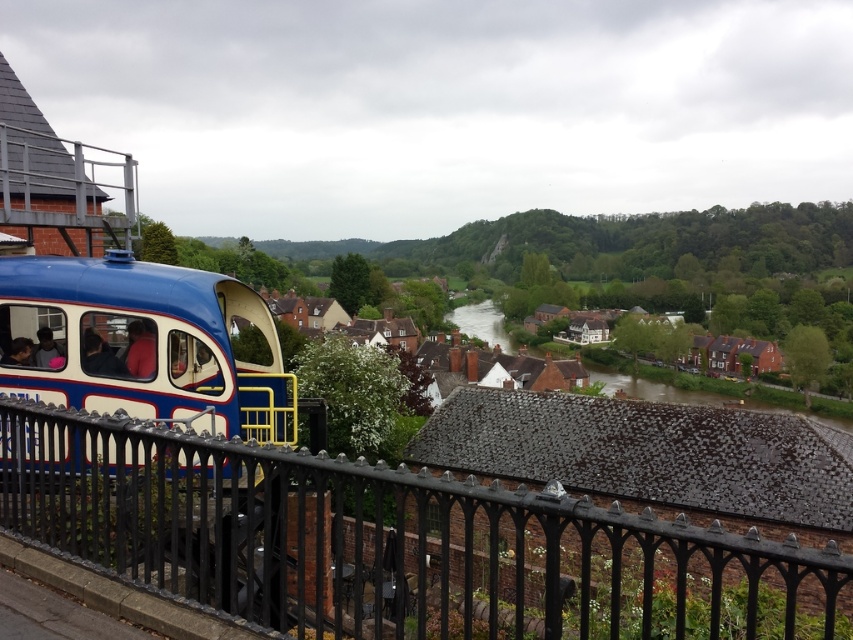
Locate an element on the screen. The width and height of the screenshot is (853, 640). black wrought iron fence at lower left is located at coordinates [392, 541].

Is point (842, 560) behind point (28, 353)?

That is False.

Does point (227, 604) come closer to viewer compared to point (170, 316)?

Yes, it is in front of point (170, 316).

Identify the location of black wrought iron fence at lower left. (392, 541).

Can you confirm if black wrought iron fence at lower left is positioned above clear water at center?

No, black wrought iron fence at lower left is not above clear water at center.

Between point (328, 609) and point (479, 339), which one is positioned behind?

The point (479, 339) is behind.

The width and height of the screenshot is (853, 640). In order to click on black wrought iron fence at lower left in this screenshot , I will do `click(392, 541)`.

Does matte blue train car at left have a greater width compared to clear water at center?

Incorrect, matte blue train car at left's width does not surpass clear water at center's.

Consider the image. Can you confirm if matte blue train car at left is positioned to the right of clear water at center?

In fact, matte blue train car at left is to the left of clear water at center.

Is point (200, 323) more distant than point (474, 316)?

No, (200, 323) is in front of (474, 316).

Image resolution: width=853 pixels, height=640 pixels. Find the location of `matte blue train car at left`. matte blue train car at left is located at coordinates (141, 342).